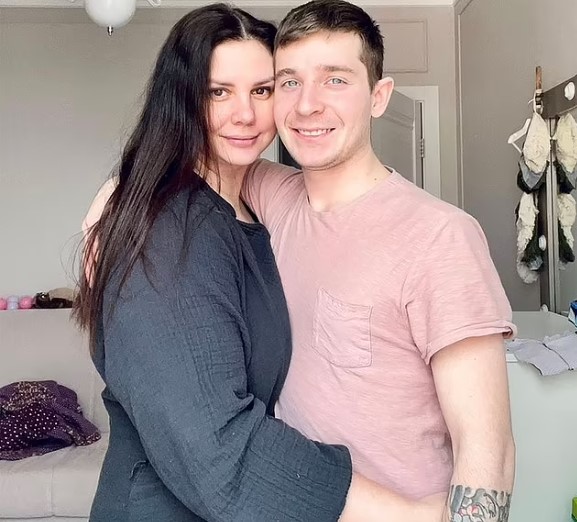
You are a GUI agent. You are given a task and a screenshot of the screen. Output one action in this format:
    pyautogui.click(x=<x>, y=<y>)
    Task: Click on the open door
    
    Given the screenshot: What is the action you would take?
    pyautogui.click(x=395, y=141)